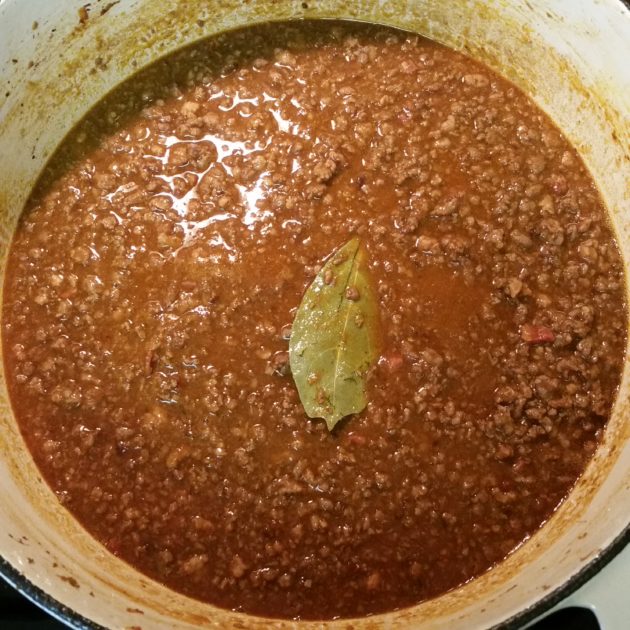
The width and height of the screenshot is (630, 630). Find the location of `blue edge of bowl`. blue edge of bowl is located at coordinates (62, 615).